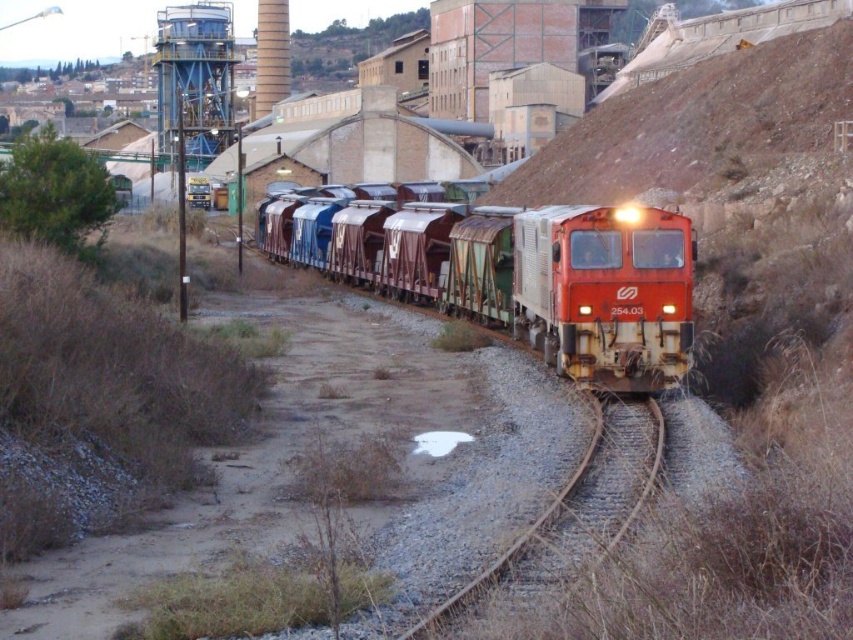
Based on the scene description, where is the rusty metal train at center located in terms of coordinates?

The rusty metal train at center is located at coordinates point [517,273].

You are a railway worker standing at the edge of the tracks. You see a rusty metal train at center and another train 70.44 feet away. Can you safely walk between them without getting hit?

The two trains are 70.44 feet apart. Since the minimum safe distance for a person to walk between moving trains is typically around 50 feet, 70.44 feet is sufficient. Therefore, you can safely walk between them without getting hit.

You are standing at point A with coordinates point A at [405,227]. You need to walk to point B, which is 42.16 meters away. Considering the rough terrain with gravel and dirt patches, will you encounter any obstacles along the way?

Since the path between point A at [405,227] and point B is 42.16 meters long and the terrain is rough with gravel and dirt patches, you will likely encounter obstacles such as uneven ground and loose gravel along the way.